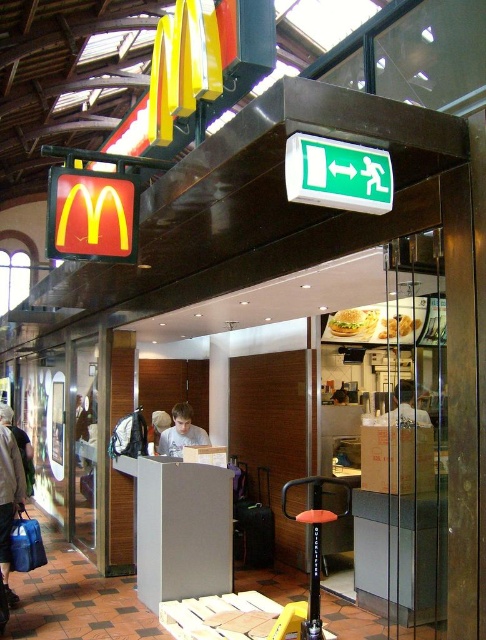
Question: Which point is farther to the camera?

Choices:
 (A) denim jacket at lower left
 (B) golden crispy hamburger at center

Answer: (B)

Question: Can you confirm if golden crispy hamburger at center is smaller than golden crispy chicken at center?

Choices:
 (A) no
 (B) yes

Answer: (A)

Question: Does brilliant yellow plastic sign at upper center have a smaller size compared to light blue shirt at center?

Choices:
 (A) yes
 (B) no

Answer: (A)

Question: Which point is closer to the camera?

Choices:
 (A) green plastic emergency exit sign at upper center
 (B) golden crispy chicken at center
 (C) light brown hair at center

Answer: (A)

Question: Which point appears farthest from the camera in this image?

Choices:
 (A) (374, 314)
 (B) (64, 225)

Answer: (A)

Question: Considering the relative positions of brilliant yellow plastic sign at upper center and light brown leather jacket at center in the image provided, where is brilliant yellow plastic sign at upper center located with respect to light brown leather jacket at center?

Choices:
 (A) right
 (B) left

Answer: (B)